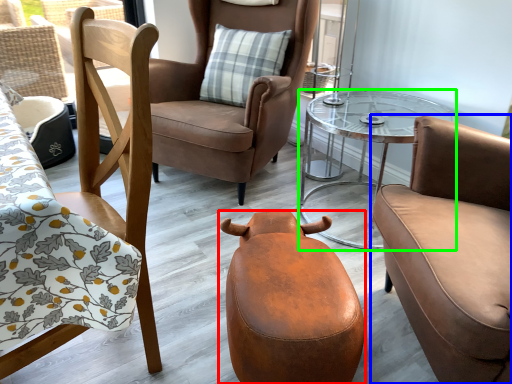
Question: Estimate the real-world distances between objects in this image. Which object is closer to swivel chair (highlighted by a red box), chair (highlighted by a blue box) or table (highlighted by a green box)?

Choices:
 (A) chair
 (B) table

Answer: (A)